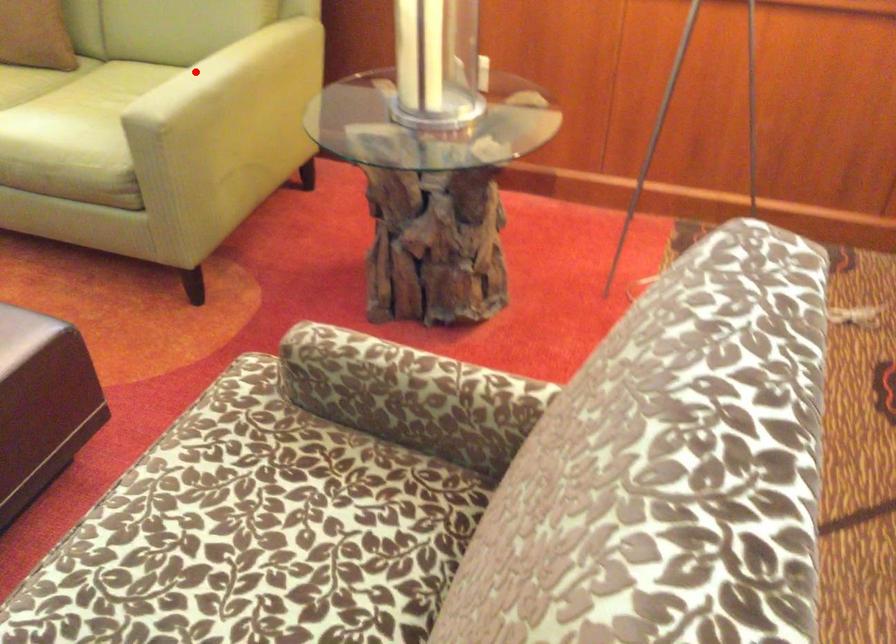
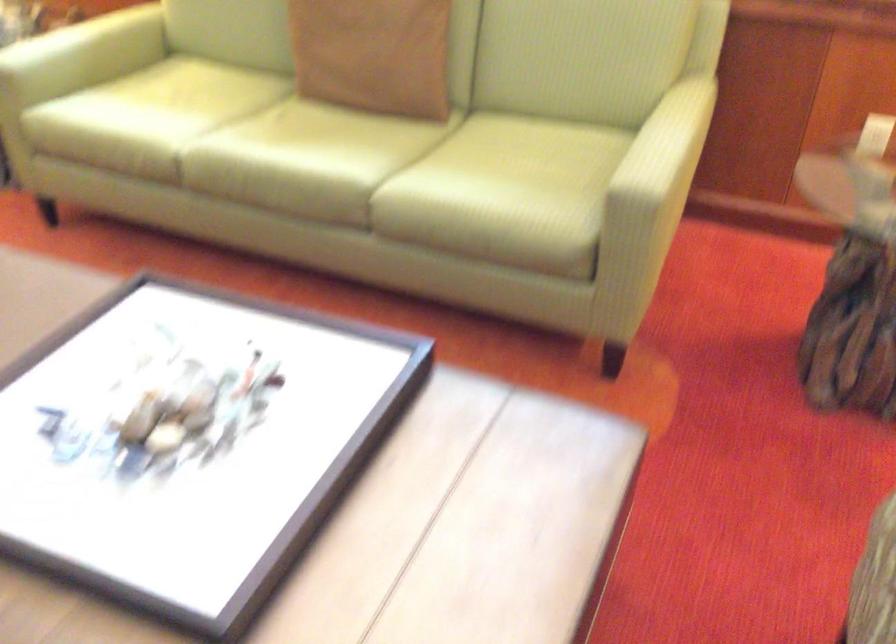
In the second image, find the point that corresponds to the highlighted location in the first image.

(668, 142)